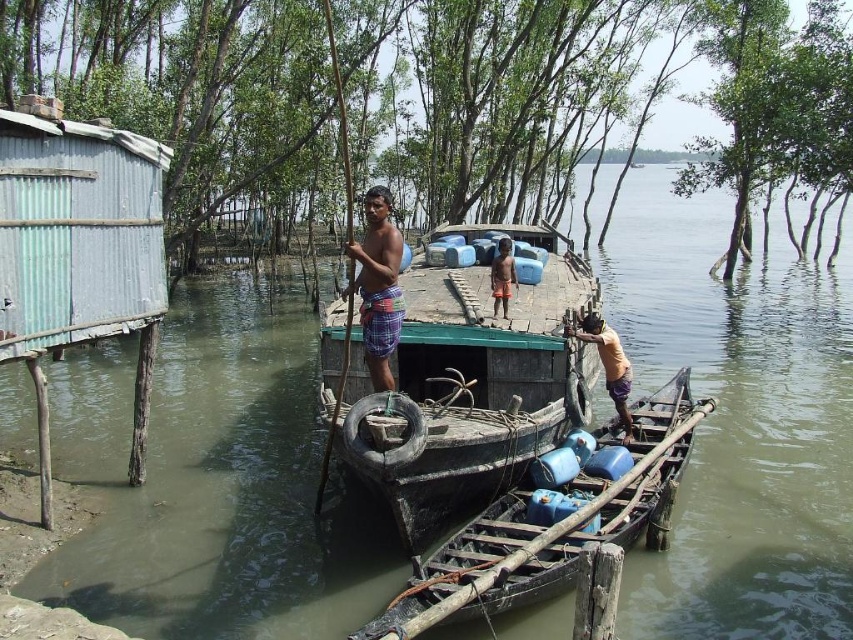
You are a traveler standing at the riverside and see the plaid fabric shorts at center and the brown woven basket at center. Which object is located to the left of the other?

The plaid fabric shorts at center is positioned on the left side of brown woven basket at center, so the plaid fabric shorts at center is to the left of the brown woven basket at center.

Looking at this image, you are a traveler standing on the riverside dock and see the plaid fabric shorts at center and the brown woven basket at center. Which object is narrower?

The plaid fabric shorts at center is narrower than the brown woven basket at center.